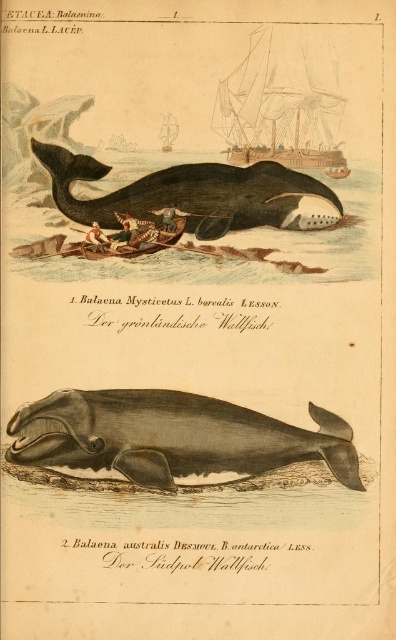
In the scene shown: Is gray matte whale at center in front of black matte whale at center?

Yes, gray matte whale at center is closer to the viewer.

Which is below, gray matte whale at center or black matte whale at center?

gray matte whale at center is below.

The image size is (396, 640). Describe the element at coordinates (171, 436) in the screenshot. I see `gray matte whale at center` at that location.

Identify the location of gray matte whale at center. This screenshot has width=396, height=640. (171, 436).

Is black matte whale at center shorter than wooden planks boat at upper center?

No, black matte whale at center is not shorter than wooden planks boat at upper center.

How far apart are black matte whale at center and wooden planks boat at upper center?

black matte whale at center is 22.84 centimeters from wooden planks boat at upper center.

Measure the distance between black matte whale at center and camera.

black matte whale at center and camera are 5.00 feet apart from each other.

Image resolution: width=396 pixels, height=640 pixels. I want to click on black matte whale at center, so click(186, 193).

Can you confirm if black matte whale at center is smaller than wooden rowboat at center?

Actually, black matte whale at center might be larger than wooden rowboat at center.

Is point (53, 152) less distant than point (161, 230)?

Yes, it is in front of point (161, 230).

At what (x,y) coordinates should I click in order to perform the action: click on black matte whale at center. Please return your answer as a coordinate pair (x, y). Looking at the image, I should click on (186, 193).